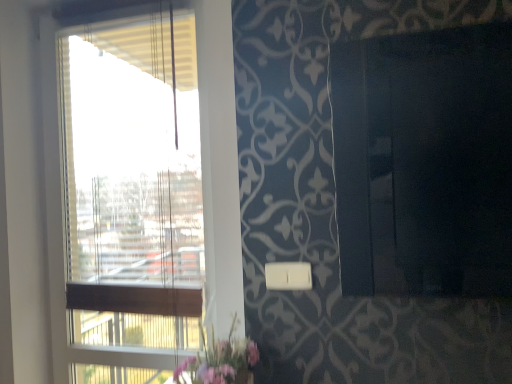
Question: Is transparent glass window at left bigger or smaller than white plastic light switch at lower center?

Choices:
 (A) small
 (B) big

Answer: (B)

Question: From a real-world perspective, is transparent glass window at left positioned above or below white plastic light switch at lower center?

Choices:
 (A) below
 (B) above

Answer: (B)

Question: Considering the real-world distances, which object is closest to the transparent glass window at left?

Choices:
 (A) pink fabric floral arrangement at lower center
 (B) white plastic light switch at lower center

Answer: (A)

Question: Estimate the real-world distances between objects in this image. Which object is farther from the transparent glass window at left?

Choices:
 (A) pink fabric floral arrangement at lower center
 (B) white plastic light switch at lower center

Answer: (B)